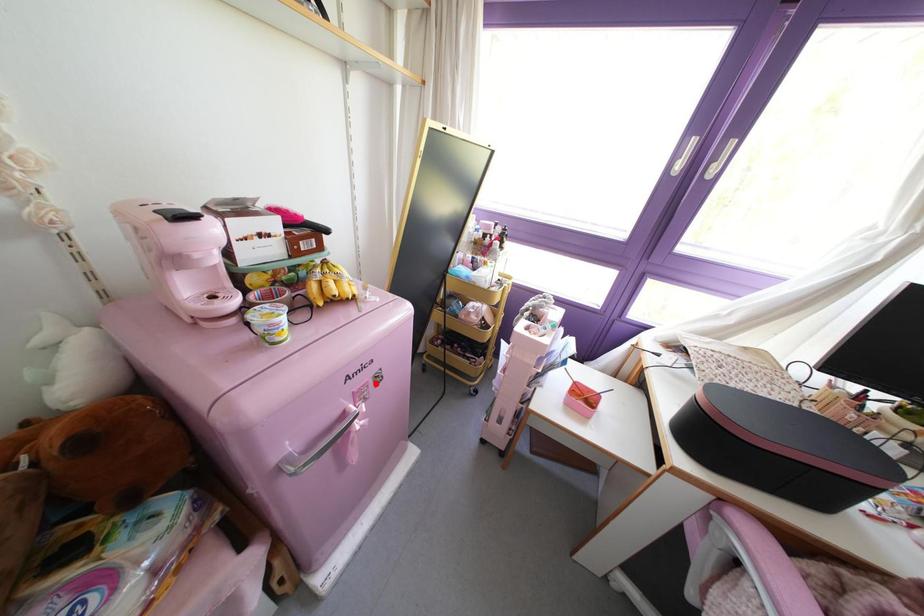
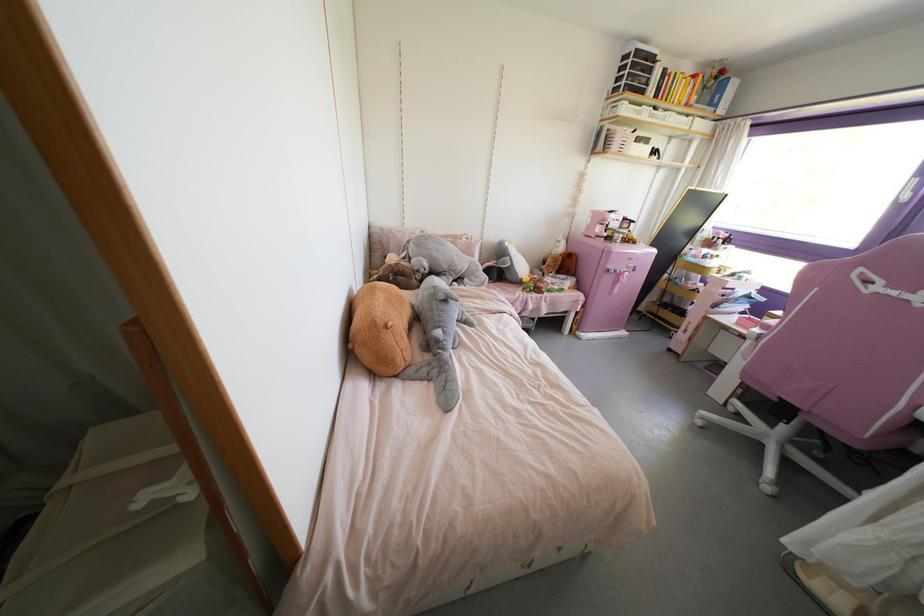
Question: I am providing you with two images of the same scene from different viewpoints. Image1 has a red point marked. In image2, the corresponding 3D location appears at what relative position? Reply with the corresponding letter.

Choices:
 (A) Closer
 (B) Farther

Answer: (A)